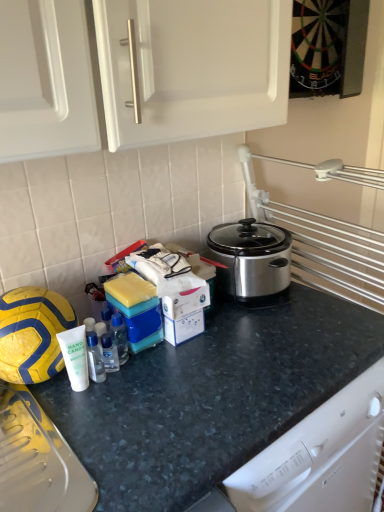
The image size is (384, 512). What are the coordinates of `free spot in front of clear plastic bottle at center, which appears as the 2th bottle when viewed from the back` in the screenshot? It's located at (92, 432).